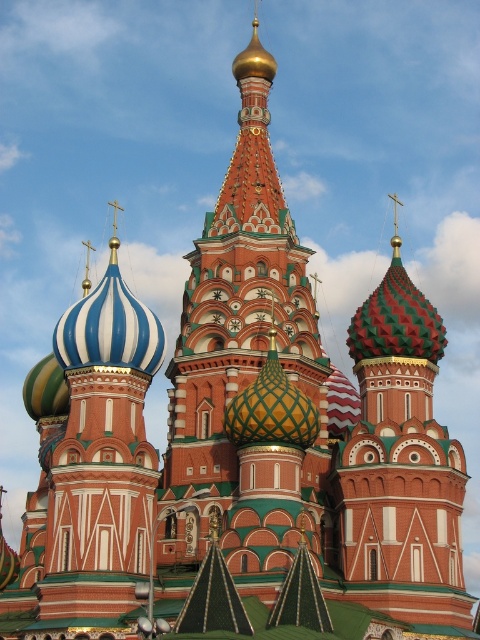
You are standing in front of the cathedral and want to locate the red brick onion dome at center. According to the coordinates provided, where would you look?

The red brick onion dome at center is located at point coordinates of [249,365].

From the picture: You are an architect assessing the cathedral. You notice the blue and white striped dome at center and the multicolored mosaic dome at center. Which dome has a greater width?

The blue and white striped dome at center might be wider than multicolored mosaic dome at center according to the description provided.

You are an architect examining the cathedral. You notice the blue and white striped dome at center and the multicolored mosaic dome at center. Which of these two domes is positioned lower in the structure?

The blue and white striped dome at center is positioned below the multicolored mosaic dome at center, so it is lower in the structure.